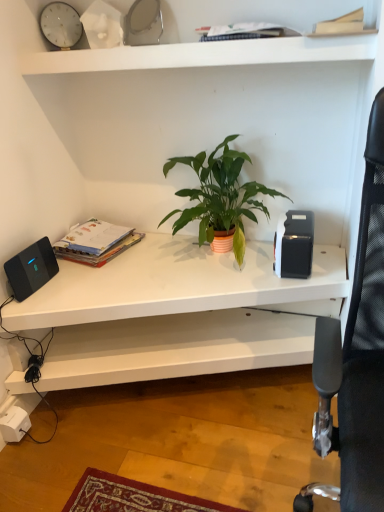
You are a GUI agent. You are given a task and a screenshot of the screen. Output one action in this format:
    pyautogui.click(x=<x>, y=<y>)
    Task: Click on the free point in front of matte paperbacks at left, the second paperback book in the right-to-left sequence
    Image resolution: width=384 pixels, height=512 pixels.
    Given the screenshot: What is the action you would take?
    pyautogui.click(x=91, y=279)